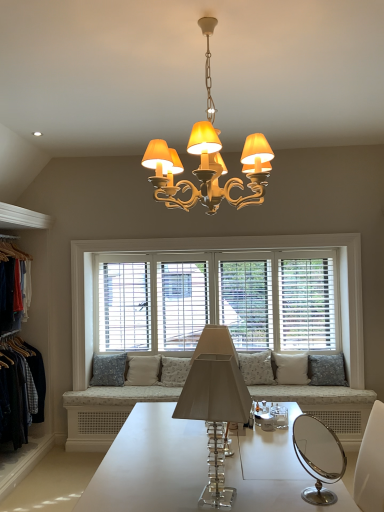
Question: From the image's perspective, is white wood window at center located beneath white fabric pillow at right, the fifth pillow when ordered from left to right?

Choices:
 (A) no
 (B) yes

Answer: (A)

Question: Would you say white fabric pillow at right, arranged as the 2th pillow when viewed from the right, is part of white wood window at center's contents?

Choices:
 (A) yes
 (B) no

Answer: (B)

Question: Is white wood window at center not close to white fabric pillow at right, the fifth pillow when ordered from left to right?

Choices:
 (A) no
 (B) yes

Answer: (A)

Question: Is white wood window at center shorter than white fabric pillow at right, the fifth pillow when ordered from left to right?

Choices:
 (A) no
 (B) yes

Answer: (A)

Question: From a real-world perspective, is white wood window at center positioned under white fabric pillow at right, the fifth pillow when ordered from left to right, based on gravity?

Choices:
 (A) yes
 (B) no

Answer: (B)

Question: Is white wood window at center behind white fabric pillow at right, the fifth pillow when ordered from left to right?

Choices:
 (A) yes
 (B) no

Answer: (A)

Question: Considering the relative sizes of beige fabric pillow at center, which appears as the 5th pillow when viewed from the right, and clear acrylic lamp at center, the second lamp positioned from the top, in the image provided, is beige fabric pillow at center, which appears as the 5th pillow when viewed from the right, wider than clear acrylic lamp at center, the second lamp positioned from the top,?

Choices:
 (A) yes
 (B) no

Answer: (B)

Question: Is beige fabric pillow at center, which appears as the 5th pillow when viewed from the right, bigger than clear acrylic lamp at center, positioned as the first lamp in bottom-to-top order?

Choices:
 (A) yes
 (B) no

Answer: (B)

Question: Is beige fabric pillow at center, which appears as the 5th pillow when viewed from the right, smaller than clear acrylic lamp at center, positioned as the first lamp in bottom-to-top order?

Choices:
 (A) no
 (B) yes

Answer: (B)

Question: Can you see beige fabric pillow at center, which ranks as the second pillow in left-to-right order, touching clear acrylic lamp at center, the second lamp positioned from the top?

Choices:
 (A) yes
 (B) no

Answer: (B)

Question: Is beige fabric pillow at center, which ranks as the second pillow in left-to-right order, oriented away from clear acrylic lamp at center, positioned as the first lamp in bottom-to-top order?

Choices:
 (A) no
 (B) yes

Answer: (A)

Question: From a real-world perspective, is beige fabric pillow at center, which ranks as the second pillow in left-to-right order, positioned over clear acrylic lamp at center, positioned as the first lamp in bottom-to-top order, based on gravity?

Choices:
 (A) yes
 (B) no

Answer: (B)

Question: Is denim jacket at left looking in the opposite direction of white fabric pillow at right, arranged as the 2th pillow when viewed from the right?

Choices:
 (A) yes
 (B) no

Answer: (B)